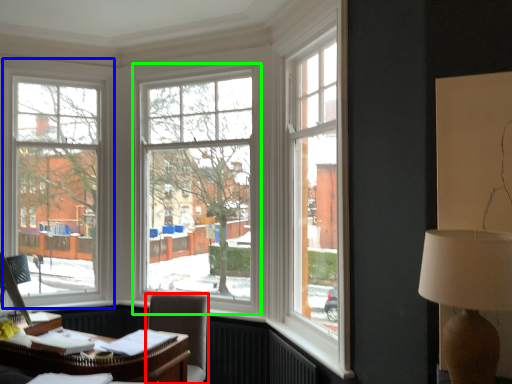
Question: Which object is positioned closest to chair (highlighted by a red box)? Select from window (highlighted by a blue box) and window (highlighted by a green box).

Choices:
 (A) window
 (B) window

Answer: (B)